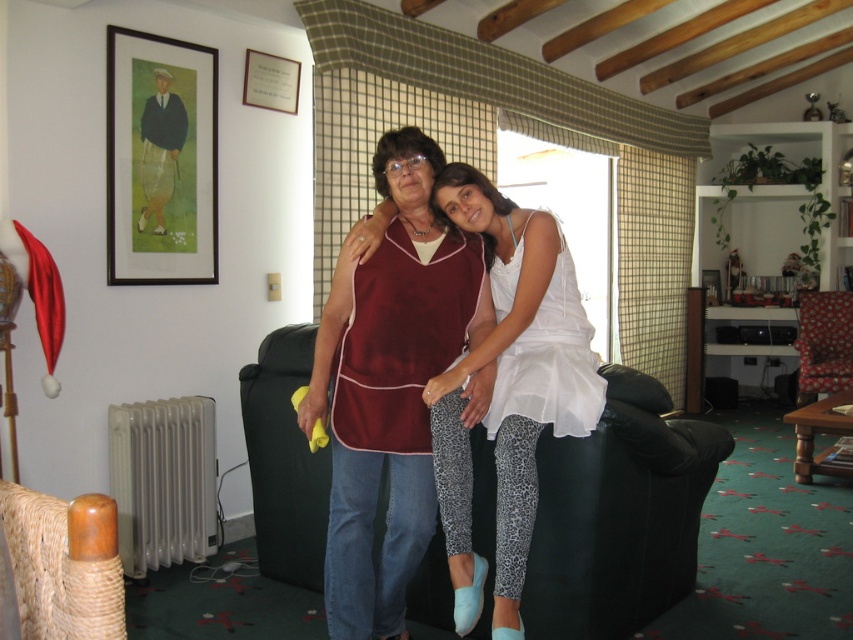
You are standing in the living room and want to place a new decorative pillow on the velvet maroon dress at center. Based on the coordinates provided, where should you place the pillow?

The velvet maroon dress at center is located at coordinates point (x=509, y=387), so you should place the decorative pillow at that position.

Consider the image. You are standing in the living room and want to place a small potted plant between the two points marked as point (445, 371) and point (51, 552). Since the plant needs to be placed exactly halfway between them, where should you place it?

The halfway point between point (445, 371) and point (51, 552) would be at coordinates calculated by averaging their x and y values. The midpoint is at x coordinate 0.7215 and y coordinate 0.2925, so you should place the potted plant at point 0.7215, 0.2925.